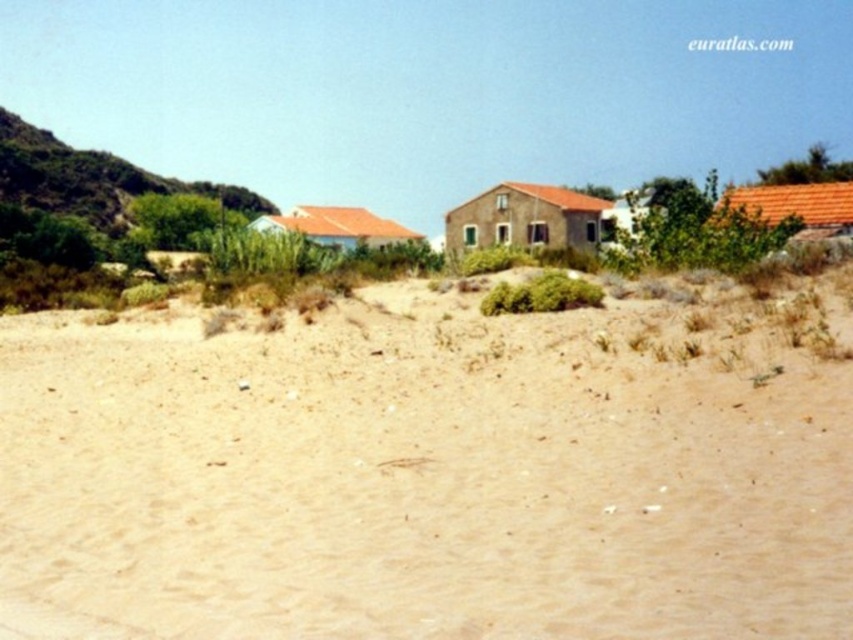
Can you confirm if light brown sand at lower center is smaller than green shrubbery at left?

Indeed, light brown sand at lower center has a smaller size compared to green shrubbery at left.

In order to click on light brown sand at lower center in this screenshot , I will do `click(428, 472)`.